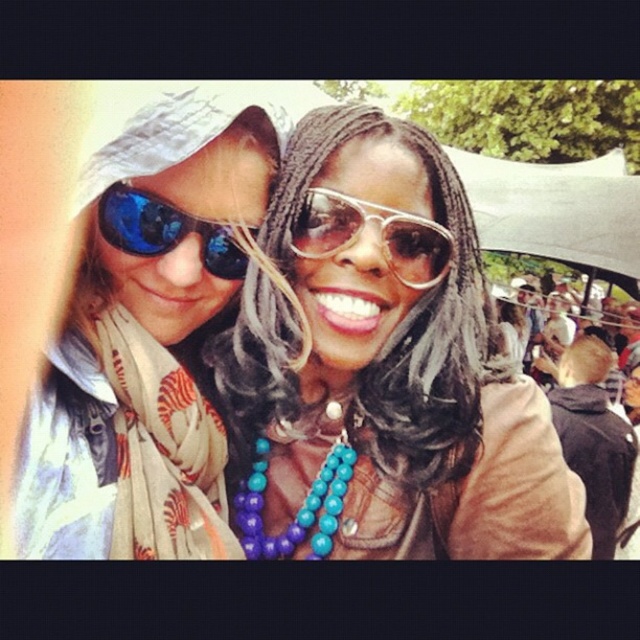
Question: Is teal beaded necklace at center wider than matte black sunglasses at upper left?

Choices:
 (A) yes
 (B) no

Answer: (A)

Question: Which object is positioned closest to the blue reflective sunglasses at left?

Choices:
 (A) turquoise beaded necklace at center
 (B) teal beaded necklace at center

Answer: (B)

Question: Which point is farther to the camera?

Choices:
 (A) (218, 556)
 (B) (241, 492)
 (C) (145, 225)

Answer: (B)

Question: Considering the relative positions of clear plastic sunglasses at center and turquoise beaded necklace at center in the image provided, where is clear plastic sunglasses at center located with respect to turquoise beaded necklace at center?

Choices:
 (A) right
 (B) left

Answer: (A)

Question: Estimate the real-world distances between objects in this image. Which object is farther from the clear plastic sunglasses at center?

Choices:
 (A) blue reflective sunglasses at left
 (B) matte black sunglasses at upper left
 (C) turquoise beaded necklace at center

Answer: (C)

Question: Does matte black sunglasses at upper left appear on the left side of clear plastic sunglasses at center?

Choices:
 (A) no
 (B) yes

Answer: (B)